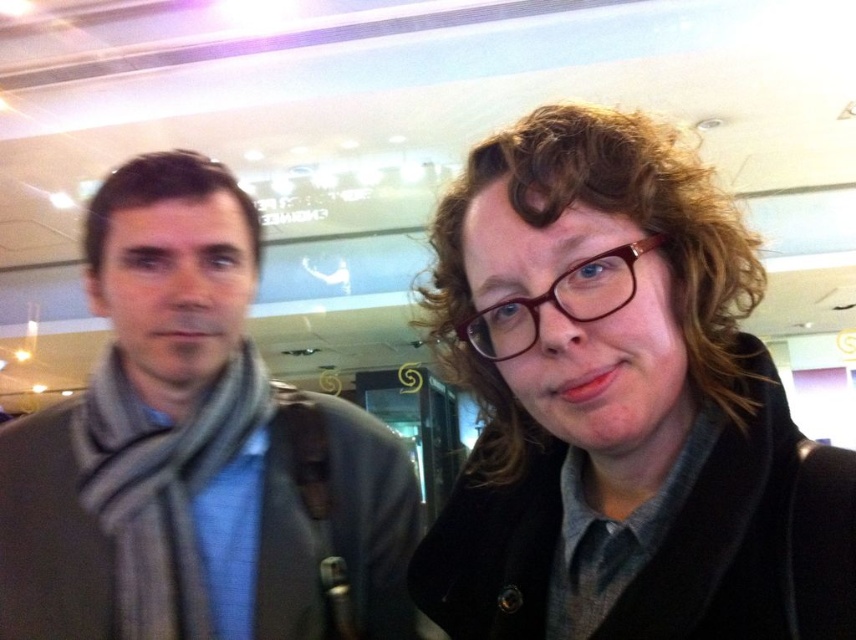
Is gray wool scarf at left thinner than brown matte glasses at center?

In fact, gray wool scarf at left might be wider than brown matte glasses at center.

Locate an element on the screen. The height and width of the screenshot is (640, 856). gray wool scarf at left is located at coordinates (195, 452).

Who is shorter, matte black coat at right or gray wool scarf at left?

With less height is matte black coat at right.

Which is more to the left, matte black coat at right or gray wool scarf at left?

From the viewer's perspective, gray wool scarf at left appears more on the left side.

Is point (682, 192) positioned in front of point (39, 433)?

That is True.

This screenshot has width=856, height=640. Identify the location of matte black coat at right. (623, 404).

Between point (497, 572) and point (485, 328), which one is positioned in front?

Point (485, 328)

Is point (783, 611) behind point (548, 296)?

Yes.

At what (x,y) coordinates should I click in order to perform the action: click on matte black coat at right. Please return your answer as a coordinate pair (x, y). The height and width of the screenshot is (640, 856). Looking at the image, I should click on point(623,404).